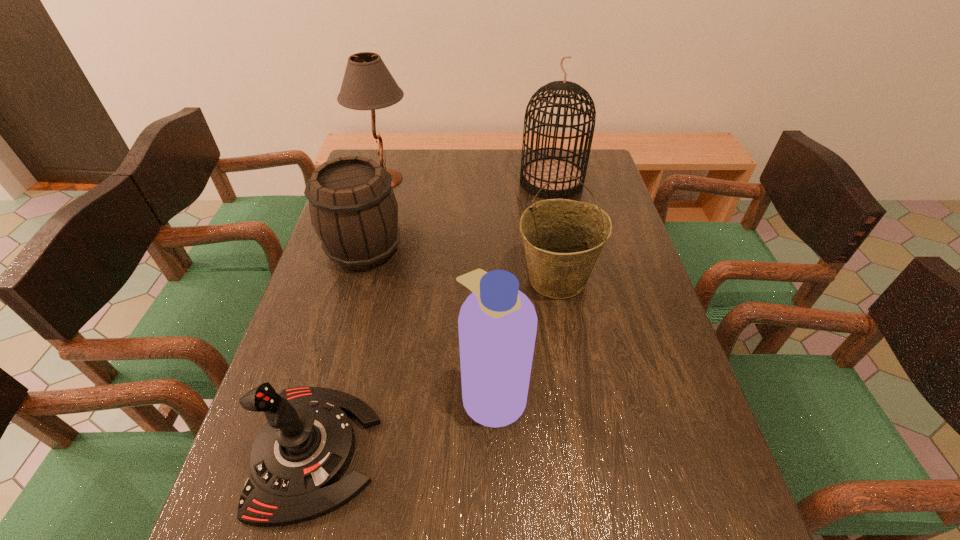
Locate an element on the screen. vacant space situated on the back of the shorter wine bucket is located at coordinates (378, 198).

Locate an element on the screen. This screenshot has height=540, width=960. vacant point located 0.170m on the handle side of the shortest object is located at coordinates (465, 451).

You are a GUI agent. You are given a task and a screenshot of the screen. Output one action in this format:
    pyautogui.click(x=<x>, y=<y>)
    Task: Click on the birdcage that is at the far edge
    This screenshot has width=960, height=540.
    Given the screenshot: What is the action you would take?
    (536, 173)

The image size is (960, 540). Identify the location of table lamp present at the far edge. (367, 84).

You are a GUI agent. You are given a task and a screenshot of the screen. Output one action in this format:
    pyautogui.click(x=<x>, y=<y>)
    Task: Click on the table lamp present at the left edge
    
    Given the screenshot: What is the action you would take?
    pyautogui.click(x=367, y=84)

What are the coordinates of `wine bucket situated at the left edge` in the screenshot? It's located at (353, 209).

Locate an element on the screen. Image resolution: width=960 pixels, height=540 pixels. joystick that is at the left edge is located at coordinates (298, 456).

The width and height of the screenshot is (960, 540). What are the coordinates of `birdcage that is positioned at the right edge` in the screenshot? It's located at (536, 173).

Locate an element on the screen. The image size is (960, 540). wine bucket that is at the right edge is located at coordinates (562, 238).

Image resolution: width=960 pixels, height=540 pixels. Find the location of `object that is at the far left corner`. object that is at the far left corner is located at coordinates (367, 84).